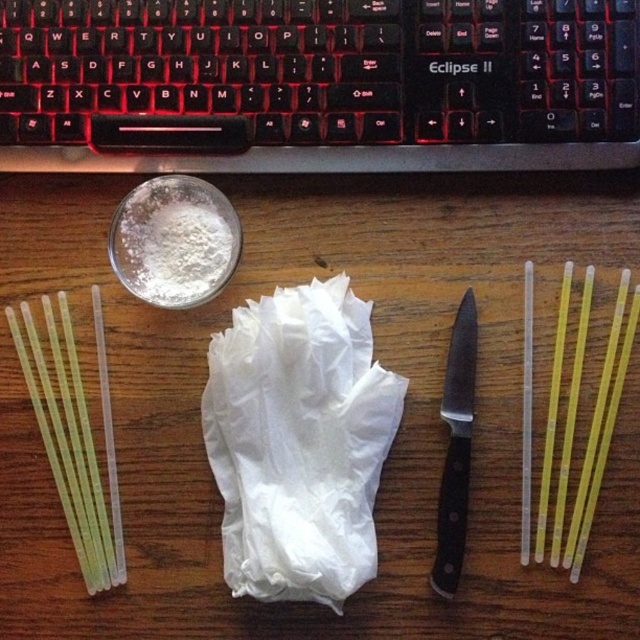
Question: Estimate the real-world distances between objects in this image. Which object is farther from the wooden table at center?

Choices:
 (A) white matte plastic bag at center
 (B) translucent plastic straw at right

Answer: (B)

Question: Can you confirm if white matte plastic bag at center is bigger than translucent yellow straw at left?

Choices:
 (A) yes
 (B) no

Answer: (A)

Question: Among these points, which one is farthest from the camera?

Choices:
 (A) (524, 346)
 (B) (570, 387)

Answer: (A)

Question: Which point is closer to the camera?

Choices:
 (A) translucent yellow straw at left
 (B) white matte plastic bag at center
 (C) translucent plastic straw at right

Answer: (B)

Question: Can you confirm if translucent yellow straw at left is positioned below translucent plastic straw at right?

Choices:
 (A) no
 (B) yes

Answer: (B)

Question: Can you confirm if black plastic keyboard at upper center is smaller than translucent plastic straw at right?

Choices:
 (A) yes
 (B) no

Answer: (B)